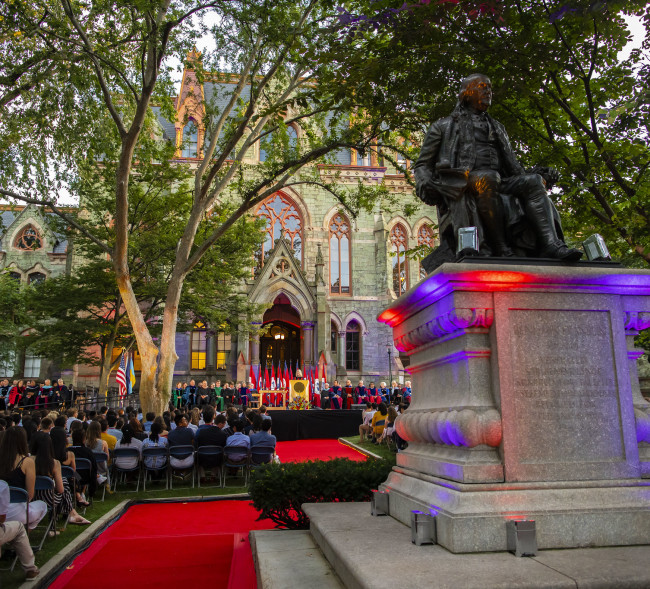
This screenshot has width=650, height=589. Identify the location of 1 red carpet. (143, 552).